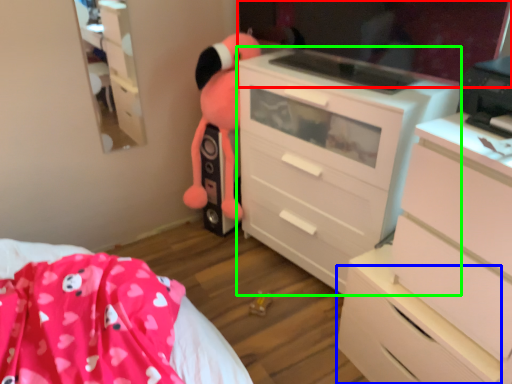
Question: Based on their relative distances, which object is farther from mirror (highlighted by a red box)? Choose from drawer (highlighted by a blue box) and chest of drawers (highlighted by a green box).

Choices:
 (A) drawer
 (B) chest of drawers

Answer: (A)